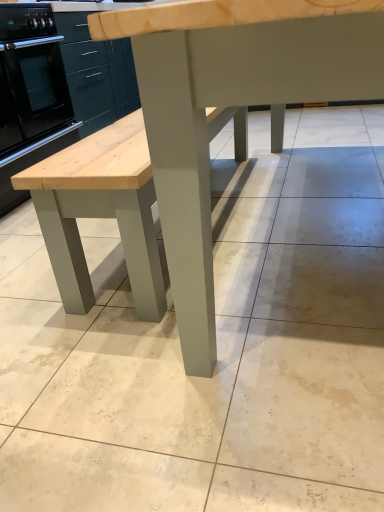
The height and width of the screenshot is (512, 384). What do you see at coordinates (31, 95) in the screenshot? I see `black glossy oven at left` at bounding box center [31, 95].

Locate an element on the screen. The width and height of the screenshot is (384, 512). black glossy oven at left is located at coordinates (31, 95).

In order to face black glossy oven at left, should I rotate leftwards or rightwards?

It's best to rotate left around 26.227 degrees.

Identify the location of matte gray table at center. This screenshot has width=384, height=512. (231, 106).

The height and width of the screenshot is (512, 384). What do you see at coordinates (231, 106) in the screenshot?
I see `matte gray table at center` at bounding box center [231, 106].

This screenshot has height=512, width=384. What are the coordinates of `black glossy oven at left` in the screenshot? It's located at (31, 95).

Considering the relative positions of matte gray table at center and black glossy oven at left in the image provided, is matte gray table at center to the left of black glossy oven at left from the viewer's perspective?

No, matte gray table at center is not to the left of black glossy oven at left.

Which object is closer to the camera, matte gray table at center or black glossy oven at left?

matte gray table at center is closer to the camera.

Which is in front, point (283, 125) or point (25, 83)?

The point (25, 83) is in front.

From the image's perspective, does matte gray table at center appear higher than black glossy oven at left?

No, from the image's perspective, matte gray table at center is not above black glossy oven at left.

From a real-world perspective, is matte gray table at center below black glossy oven at left?

No, from a real-world perspective, matte gray table at center is not under black glossy oven at left.

From the picture: Considering the sizes of objects matte gray table at center and black glossy oven at left in the image provided, who is thinner, matte gray table at center or black glossy oven at left?

black glossy oven at left.

Can you confirm if matte gray table at center is taller than black glossy oven at left?

Correct, matte gray table at center is much taller as black glossy oven at left.

Is matte gray table at center bigger or smaller than black glossy oven at left?

In the image, matte gray table at center appears to be larger than black glossy oven at left.

Does matte gray table at center contain black glossy oven at left?

No.

Is matte gray table at center with black glossy oven at left?

No, matte gray table at center is not beside black glossy oven at left.

Is matte gray table at center turned away from black glossy oven at left?

That's not correct — matte gray table at center is not looking away from black glossy oven at left.

How many degrees apart are the facing directions of matte gray table at center and black glossy oven at left?

87.6 degrees.

You are a GUI agent. You are given a task and a screenshot of the screen. Output one action in this format:
    pyautogui.click(x=<x>, y=<y>)
    Task: Click on the oven above the matte gray table at center (from the image's perspective)
    
    Given the screenshot: What is the action you would take?
    pyautogui.click(x=31, y=95)

Which object is positioned more to the right, black glossy oven at left or matte gray table at center?

matte gray table at center is more to the right.

Considering their positions, is black glossy oven at left located in front of or behind matte gray table at center?

In the image, black glossy oven at left appears behind matte gray table at center.

Which point is more forward, (4, 106) or (197, 257)?

Positioned in front is point (197, 257).

From the image's perspective, is black glossy oven at left over matte gray table at center?

Correct, black glossy oven at left appears higher than matte gray table at center in the image.

From a real-world perspective, is black glossy oven at left below matte gray table at center?

Yes, from a real-world perspective, black glossy oven at left is below matte gray table at center.

Is black glossy oven at left thinner than matte gray table at center?

Yes, black glossy oven at left is thinner than matte gray table at center.

Considering the sizes of objects black glossy oven at left and matte gray table at center in the image provided, who is taller, black glossy oven at left or matte gray table at center?

Standing taller between the two is matte gray table at center.

Looking at the image, does black glossy oven at left seem bigger or smaller compared to matte gray table at center?

In the image, black glossy oven at left appears to be smaller than matte gray table at center.

Is black glossy oven at left positioned beyond the bounds of matte gray table at center?

That's correct, black glossy oven at left is outside of matte gray table at center.

Are black glossy oven at left and matte gray table at center located far from each other?

Indeed, black glossy oven at left is not near matte gray table at center.

Could you tell me if black glossy oven at left is turned towards matte gray table at center?

Yes, black glossy oven at left is aimed at matte gray table at center.

What's the angular difference between black glossy oven at left and matte gray table at center's facing directions?

The angular difference between black glossy oven at left and matte gray table at center is 87.6 degrees.

How distant is black glossy oven at left from matte gray table at center?

A distance of 1.76 meters exists between black glossy oven at left and matte gray table at center.

Locate an element on the screen. The image size is (384, 512). oven above the matte gray table at center (from the image's perspective) is located at coordinates (31, 95).

What are the coordinates of `oven that appears above the matte gray table at center (from the image's perspective)` in the screenshot? It's located at (31, 95).

Where is `table in front of the black glossy oven at left`? The image size is (384, 512). table in front of the black glossy oven at left is located at coordinates (231, 106).